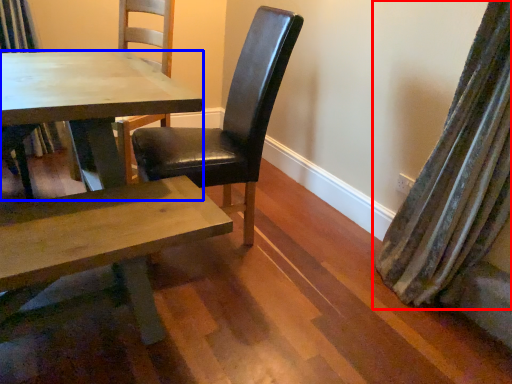
Question: Among these objects, which one is farthest to the camera, curtain (highlighted by a red box) or kitchen & dining room table (highlighted by a blue box)?

Choices:
 (A) curtain
 (B) kitchen & dining room table

Answer: (B)